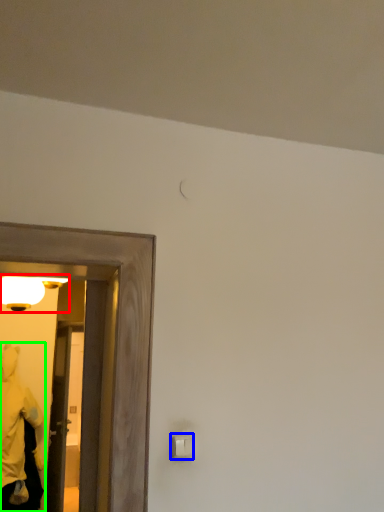
Question: Considering the real-world distances, which object is closest to light fixture (highlighted by a red box)? light switch (highlighted by a blue box) or person (highlighted by a green box).

Choices:
 (A) light switch
 (B) person

Answer: (B)